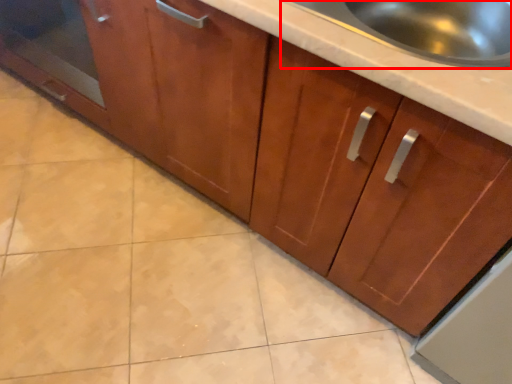
Question: From the image's perspective, what is the correct spatial relationship of sink (annotated by the red box) in relation to glass door?

Choices:
 (A) above
 (B) below

Answer: (B)